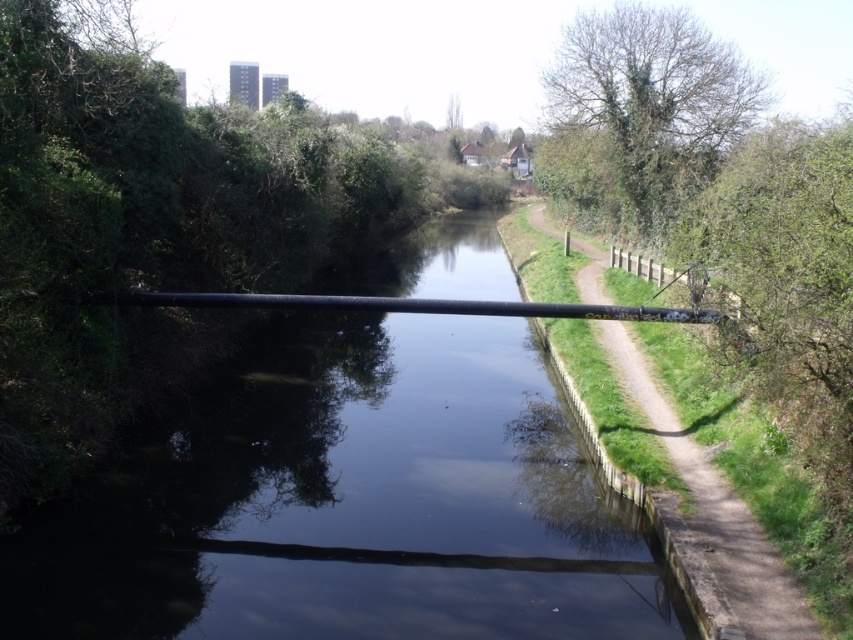
Question: Is green leafy tree at upper right smaller than dirt path at right?

Choices:
 (A) yes
 (B) no

Answer: (B)

Question: Which point is closer to the camera taking this photo?

Choices:
 (A) (737, 532)
 (B) (659, 572)
 (C) (567, 84)

Answer: (A)

Question: Which of the following is the closest to the observer?

Choices:
 (A) (642, 168)
 (B) (209, 525)

Answer: (B)

Question: Where is black pipe at center located in relation to green leafy tree at upper right in the image?

Choices:
 (A) above
 (B) below

Answer: (B)

Question: Can you confirm if green leafy tree at upper right is positioned to the right of dirt path at right?

Choices:
 (A) yes
 (B) no

Answer: (A)

Question: Which object appears farthest from the camera in this image?

Choices:
 (A) green leafy tree at upper right
 (B) dirt path at right

Answer: (A)